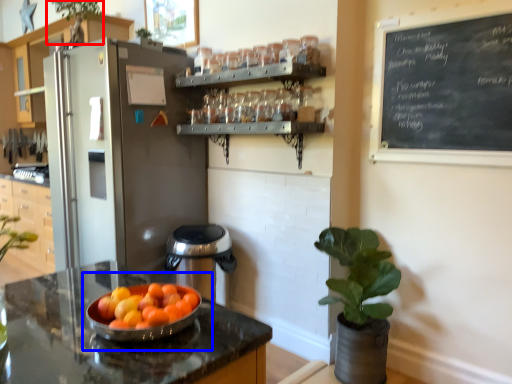
Question: Which object appears closest to the camera in this image, plant (highlighted by a red box) or fruit dish (highlighted by a blue box)?

Choices:
 (A) plant
 (B) fruit dish

Answer: (B)